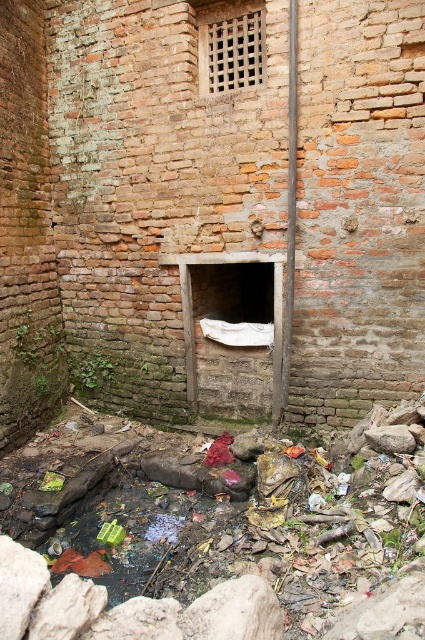
Question: Which point is farther to the camera?

Choices:
 (A) (232, 83)
 (B) (51, 280)
 (C) (289, 182)

Answer: (B)

Question: Considering the relative positions of white paper at center and smooth metallic pole at center in the image provided, where is white paper at center located with respect to smooth metallic pole at center?

Choices:
 (A) right
 (B) left

Answer: (B)

Question: Does stone lattice window at center appear under smooth metallic pole at center?

Choices:
 (A) no
 (B) yes

Answer: (A)

Question: Which point appears farthest from the camera in this image?

Choices:
 (A) (229, 45)
 (B) (320, 193)
 (C) (289, 22)

Answer: (A)

Question: Where is white paper at center located in relation to stone lattice window at center in the image?

Choices:
 (A) left
 (B) right

Answer: (A)

Question: Considering the real-world distances, which object is farthest from the stone lattice window at center?

Choices:
 (A) smooth metallic pole at center
 (B) white paper at center

Answer: (B)